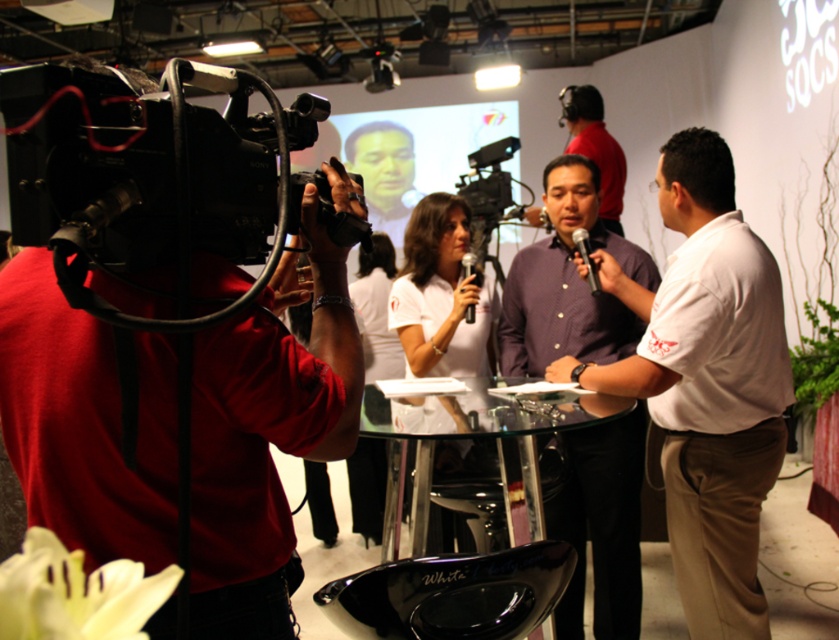
Question: Among these points, which one is farthest from the camera?

Choices:
 (A) (x=761, y=276)
 (B) (x=412, y=529)
 (C) (x=262, y=548)

Answer: (B)

Question: Is white shirt at center below transparent glass table at center?

Choices:
 (A) no
 (B) yes

Answer: (A)

Question: Among these points, which one is nearest to the camera?

Choices:
 (A) (618, 259)
 (B) (434, 417)

Answer: (B)

Question: Is white shirt at center in front of black plastic microphone at center?

Choices:
 (A) yes
 (B) no

Answer: (A)

Question: Is purple cotton shirt at center bigger than black plastic microphone at center?

Choices:
 (A) no
 (B) yes

Answer: (B)

Question: Which object appears farthest from the camera in this image?

Choices:
 (A) transparent glass table at center
 (B) matte black camera at left
 (C) black metallic microphone at center
 (D) black plastic microphone at center

Answer: (D)